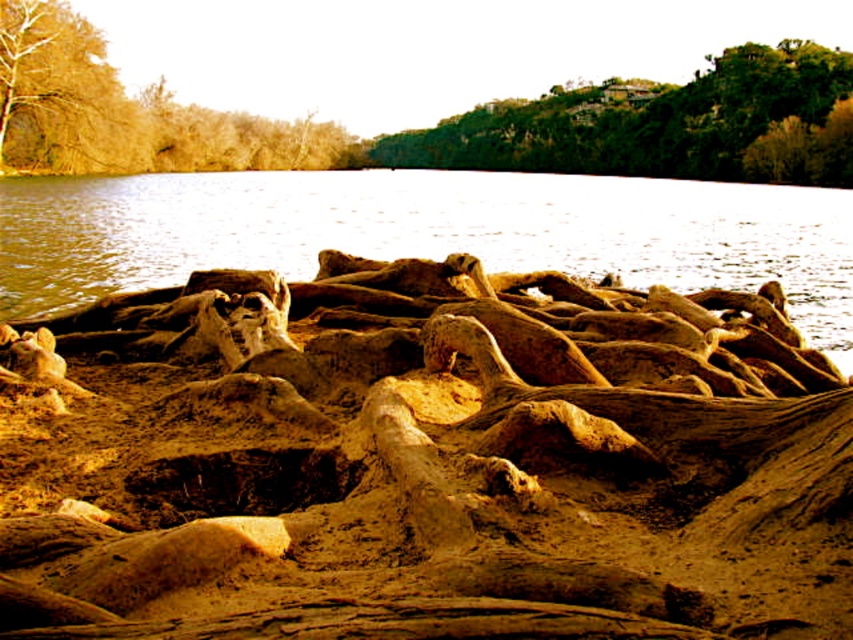
You are standing at the edge of the water and see the brown textured sand at center and the green leafy tree at upper center. Which object is closer to you?

The brown textured sand at center is closer to you because it is in front of the green leafy tree at upper center.

You are an artist planning to paint the scene. You want to ensure the green leafy tree at upper center and the brown textured tree at upper left are proportionally accurate. Which tree should you draw taller in your painting?

The green leafy tree at upper center should be drawn taller than the brown textured tree at upper left as it is taller in the scene.

You are an artist sketching the scene and want to place the green leafy tree at upper center and the brown textured tree at upper left accurately. Which tree is located to the right of the other?

The green leafy tree at upper center is positioned to the right of the brown textured tree at upper left.